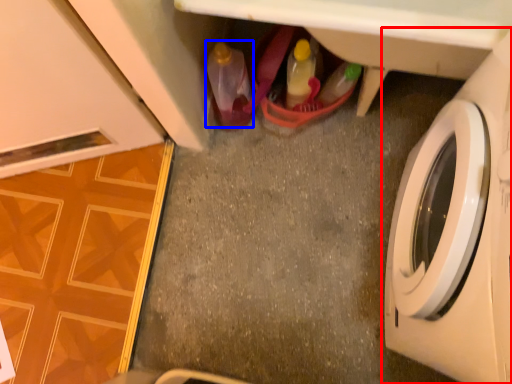
Question: Which object is closer to the camera taking this photo, washing machine (highlighted by a red box) or bottle (highlighted by a blue box)?

Choices:
 (A) washing machine
 (B) bottle

Answer: (A)